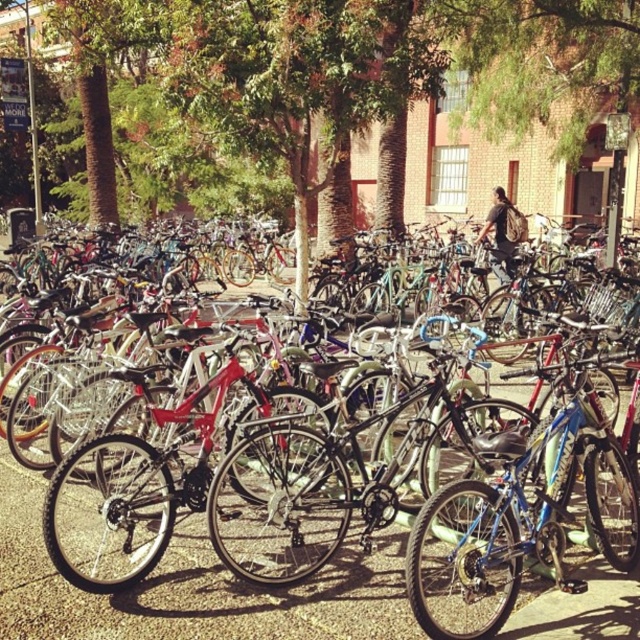
You are a delivery person who needs to park your bike in the bicycle parking area. You have a bike that is 1.5 meters wide. You see the shiny metallic bicycle at center and the blue metallic bicycle at center. Which bicycle has a width that could potentially accommodate your bike if you were to park it next to them?

The shiny metallic bicycle at center has a larger width than the blue metallic bicycle at center, so if your bike is 1.5 meters wide, it might fit better next to the shiny metallic bicycle at center since it is wider.

You are a delivery person trying to park your bicycle in the parking area. You see a shiny metallic bicycle at center and a blue metallic bicycle at center. Which bicycle is closer to the ground?

The shiny metallic bicycle at center is shorter than the blue metallic bicycle at center, so the shiny metallic bicycle at center is closer to the ground.

You are standing at point 0.5, 0.5 in the image coordinate system. Which direction should you move to reach the shiny metallic bicycle at center?

Since the shiny metallic bicycle at center is located at point (192,588), which is to the right and slightly below your current position at (320,320), you should move towards the lower right direction to reach it.